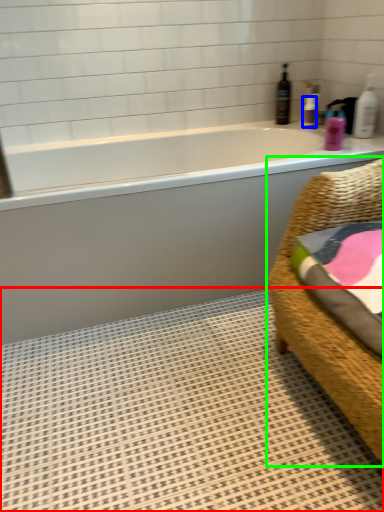
Question: Which object is positioned farthest from bath mat (highlighted by a red box)? Select from toiletry (highlighted by a blue box) and furniture (highlighted by a green box).

Choices:
 (A) toiletry
 (B) furniture

Answer: (A)